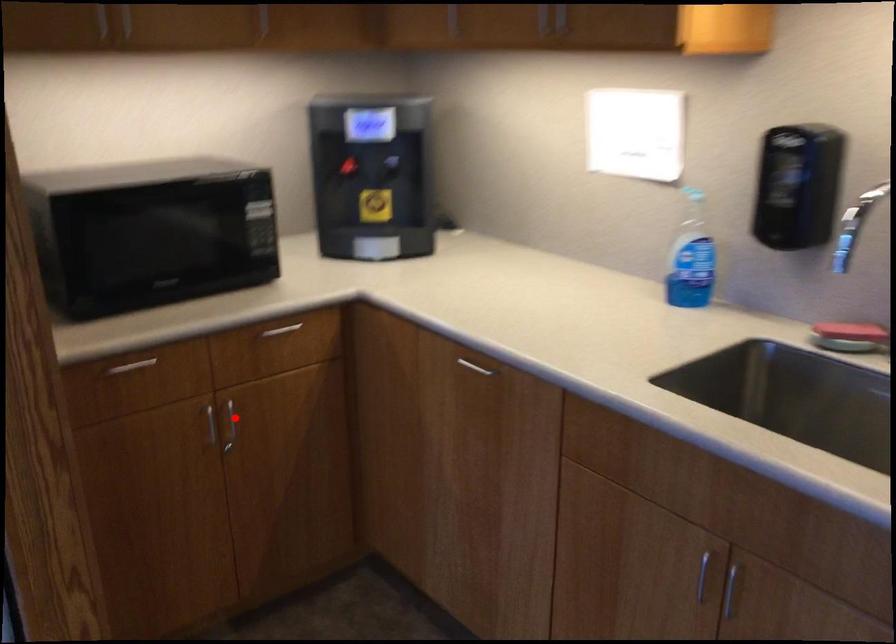
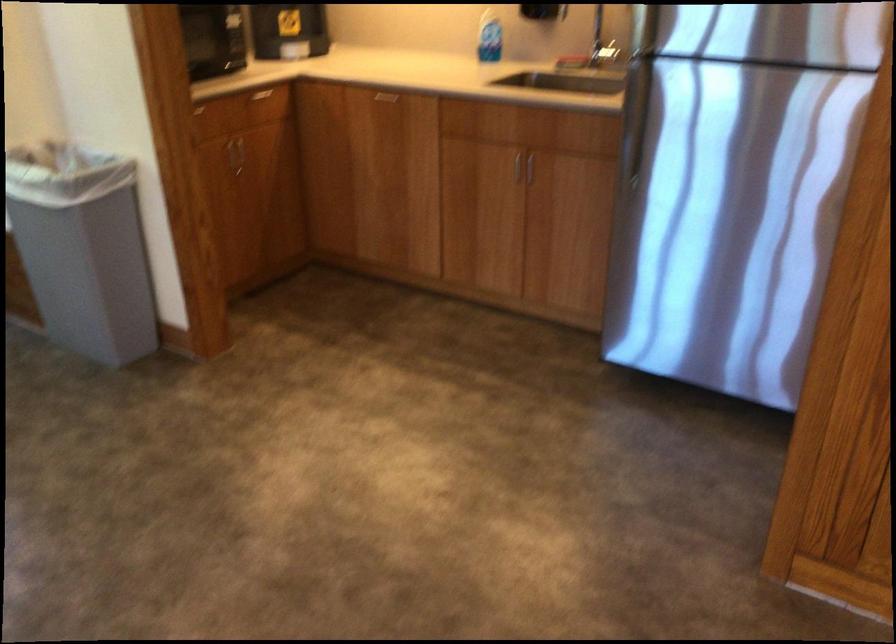
Find the pixel in the second image that matches the highlighted location in the first image.

(239, 151)